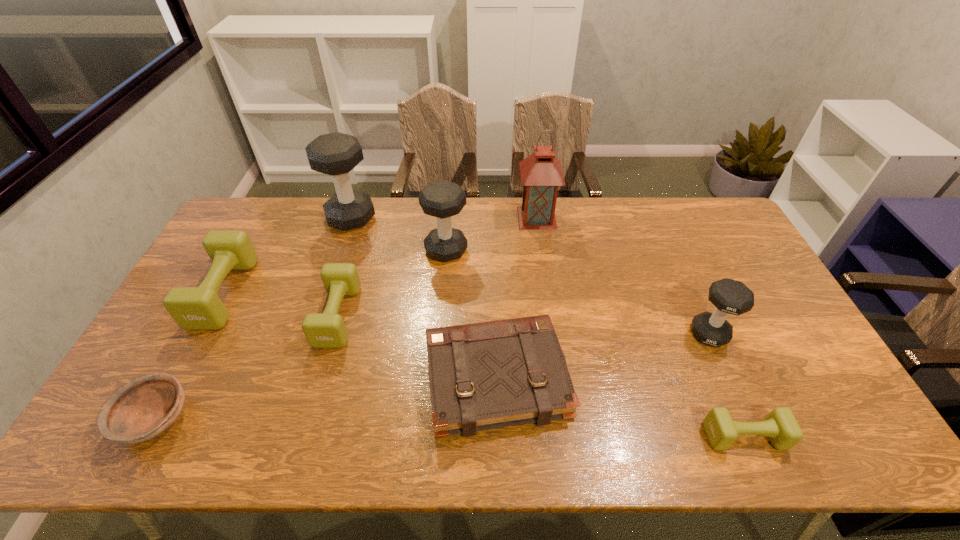
I want to click on free location located on the front of the second olive dumbbell from right to left, so click(298, 455).

Image resolution: width=960 pixels, height=540 pixels. I want to click on free spot located on the left of the hardback book, so click(351, 378).

Where is `free region located 0.260m on the back of the nearest dumbbell`? The image size is (960, 540). free region located 0.260m on the back of the nearest dumbbell is located at coordinates (701, 334).

The image size is (960, 540). Find the location of `vacant space situated on the right of the bowl`. vacant space situated on the right of the bowl is located at coordinates (211, 418).

Where is `lantern that is at the far edge`? The width and height of the screenshot is (960, 540). lantern that is at the far edge is located at coordinates (541, 173).

At what (x,y) coordinates should I click in order to perform the action: click on hardback book that is positioned at the near edge. Please return your answer as a coordinate pair (x, y). Looking at the image, I should click on (488, 375).

In order to click on dumbbell located in the near edge section of the desktop in this screenshot , I will do `click(780, 425)`.

Where is `bowl located in the near edge section of the desktop`? This screenshot has width=960, height=540. bowl located in the near edge section of the desktop is located at coordinates (142, 409).

Find the location of a particular element. The width and height of the screenshot is (960, 540). dumbbell that is at the left edge is located at coordinates (193, 308).

Identify the location of bowl present at the left edge. The width and height of the screenshot is (960, 540). (142, 409).